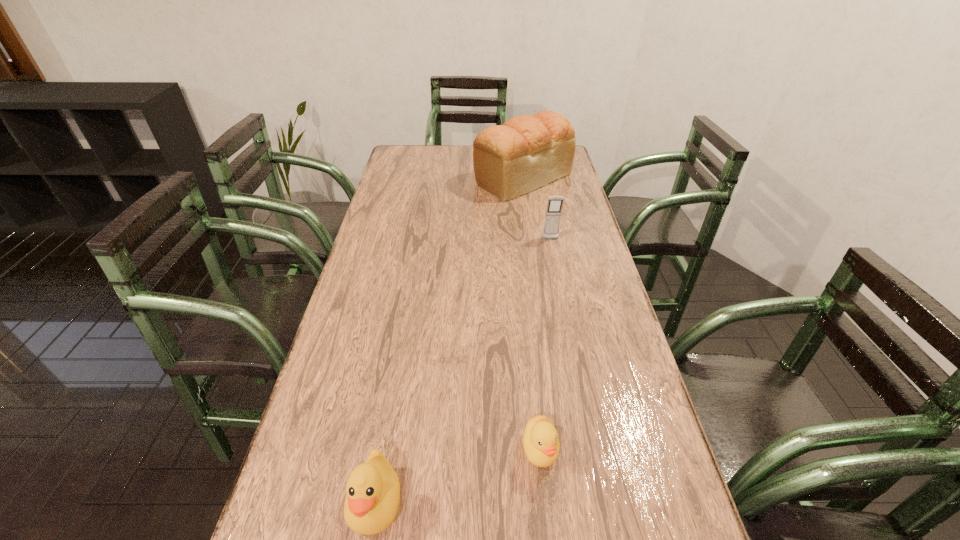
Locate an element on the screen. This screenshot has height=540, width=960. the tallest object is located at coordinates click(x=528, y=151).

Identify the location of the farthest object. The image size is (960, 540). (528, 151).

This screenshot has height=540, width=960. I want to click on the third shortest object, so click(554, 206).

Locate an element on the screen. cellular telephone is located at coordinates (554, 206).

Find the location of a particular element. The image size is (960, 540). the shortest object is located at coordinates (541, 444).

In order to click on the right duck in this screenshot , I will do `click(541, 444)`.

Find the location of `vacant area situated 0.160m on the left of the tallest object`. vacant area situated 0.160m on the left of the tallest object is located at coordinates (433, 178).

Where is `blank space located 0.260m on the front-facing side of the cellular telephone`? Image resolution: width=960 pixels, height=540 pixels. blank space located 0.260m on the front-facing side of the cellular telephone is located at coordinates (563, 296).

Where is `object positioned at the far edge`? This screenshot has width=960, height=540. object positioned at the far edge is located at coordinates click(528, 151).

Find the location of a particular element. Image resolution: width=960 pixels, height=540 pixels. bread situated at the right edge is located at coordinates (528, 151).